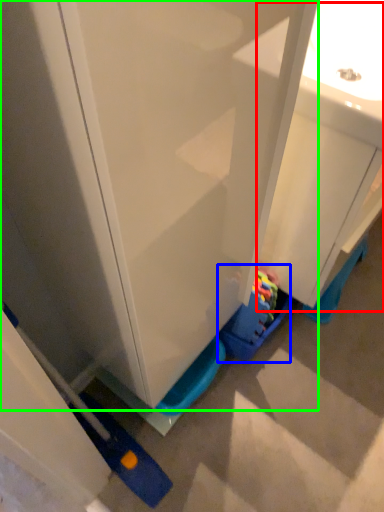
Question: Based on their relative distances, which object is farther from sink (highlighted by a red box)? Choose from toy (highlighted by a blue box) and cabinetry (highlighted by a green box).

Choices:
 (A) toy
 (B) cabinetry

Answer: (A)